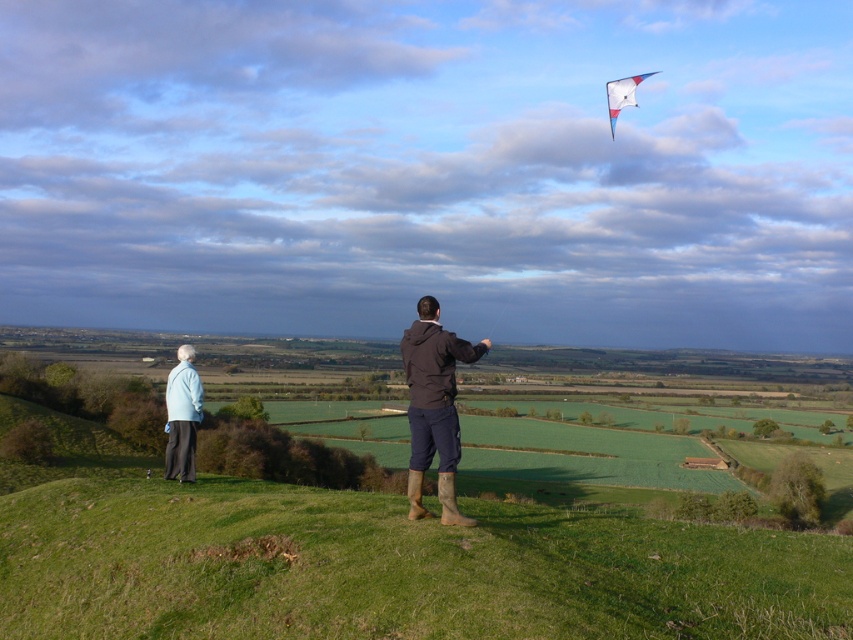
Is green grassy hillside at center above white glossy kite at upper right?

Actually, green grassy hillside at center is below white glossy kite at upper right.

Based on the photo, can you confirm if green grassy hillside at center is taller than white glossy kite at upper right?

Incorrect, green grassy hillside at center's height is not larger of white glossy kite at upper right's.

This screenshot has height=640, width=853. Describe the element at coordinates (393, 566) in the screenshot. I see `green grassy hillside at center` at that location.

At what (x,y) coordinates should I click in order to perform the action: click on green grassy hillside at center. Please return your answer as a coordinate pair (x, y). Looking at the image, I should click on (393, 566).

Does brown suede boots at lower center appear under white glossy kite at upper right?

Correct, brown suede boots at lower center is located below white glossy kite at upper right.

Can you confirm if brown suede boots at lower center is positioned to the left of white glossy kite at upper right?

Yes, brown suede boots at lower center is to the left of white glossy kite at upper right.

Find the location of a particular element. Image resolution: width=853 pixels, height=640 pixels. brown suede boots at lower center is located at coordinates (434, 406).

Between point (312, 545) and point (444, 502), which one is positioned behind?

Positioned behind is point (444, 502).

Is point (422, 579) farther from viewer compared to point (457, 428)?

No, (422, 579) is closer to viewer.

Is point (711, 620) behind point (430, 316)?

No, (711, 620) is in front of (430, 316).

You are a GUI agent. You are given a task and a screenshot of the screen. Output one action in this format:
    pyautogui.click(x=<x>, y=<y>)
    Task: Click on the green grassy hillside at center
    
    Given the screenshot: What is the action you would take?
    pyautogui.click(x=393, y=566)